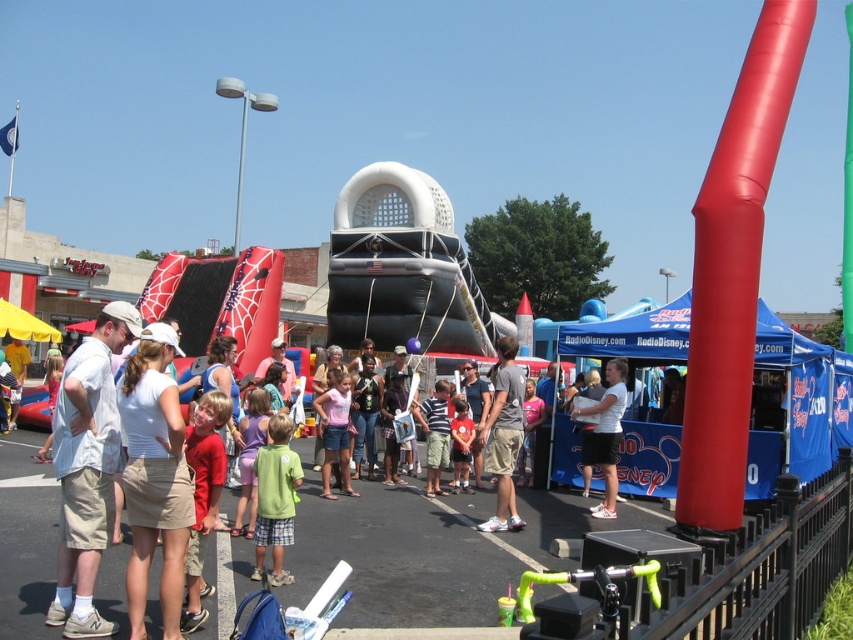
You are standing at the center of the event and want to find the white cotton shirt at left. Which direction should you look to locate it?

The white cotton shirt at left is located at the point with coordinates 0.733 on the x axis and 0.103 on the y axis. Since the x coordinate is greater than 0.5, it means it is to the right of the center. Therefore, you should look to the right to locate the white cotton shirt at left.

You are a photographer trying to capture a photo of the white cotton shirt at left and the khaki shorts at center. If you want to ensure both are visible in the frame, which object should you focus on first to avoid cropping either?

You should focus on the white cotton shirt at left first since it might be wider than the khaki shorts at center, so ensuring it fits in the frame first will help accommodate both.